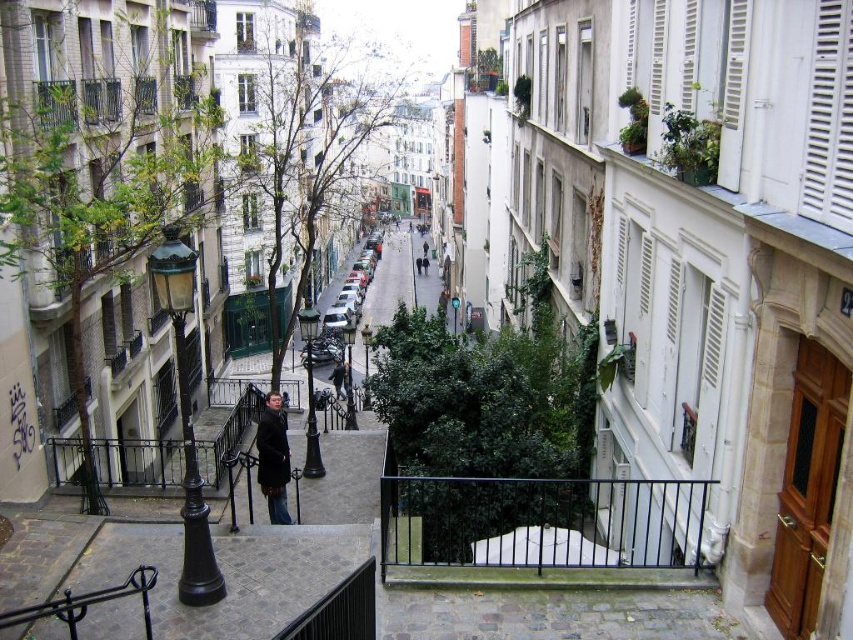
Question: Which of the following is the farthest from the observer?

Choices:
 (A) dark brown leather coat at center
 (B) black metal balustrade at center

Answer: (A)

Question: Where is black metal balustrade at center located in relation to dark brown leather coat at center in the image?

Choices:
 (A) below
 (B) above

Answer: (A)

Question: Which of the following is the farthest from the observer?

Choices:
 (A) dark brown leather coat at center
 (B) black metal balustrade at center

Answer: (A)

Question: Which object appears farthest from the camera in this image?

Choices:
 (A) black metal balustrade at center
 (B) white louvered shutter at upper right

Answer: (A)

Question: Observing the image, what is the correct spatial positioning of white louvered shutter at upper right in reference to dark brown leather coat at center?

Choices:
 (A) below
 (B) above

Answer: (B)

Question: Can you confirm if black metal balustrade at center is positioned above white louvered shutter at upper right?

Choices:
 (A) no
 (B) yes

Answer: (A)